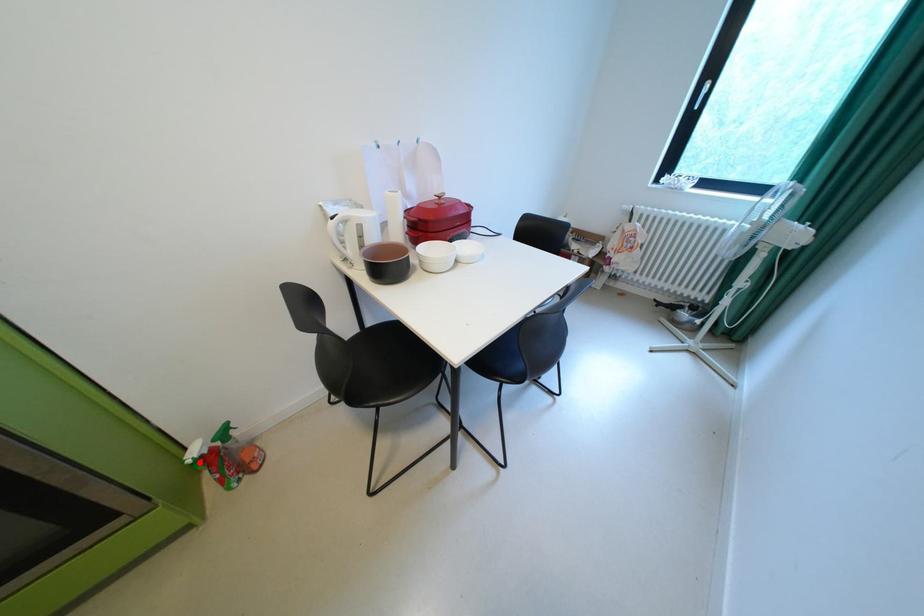
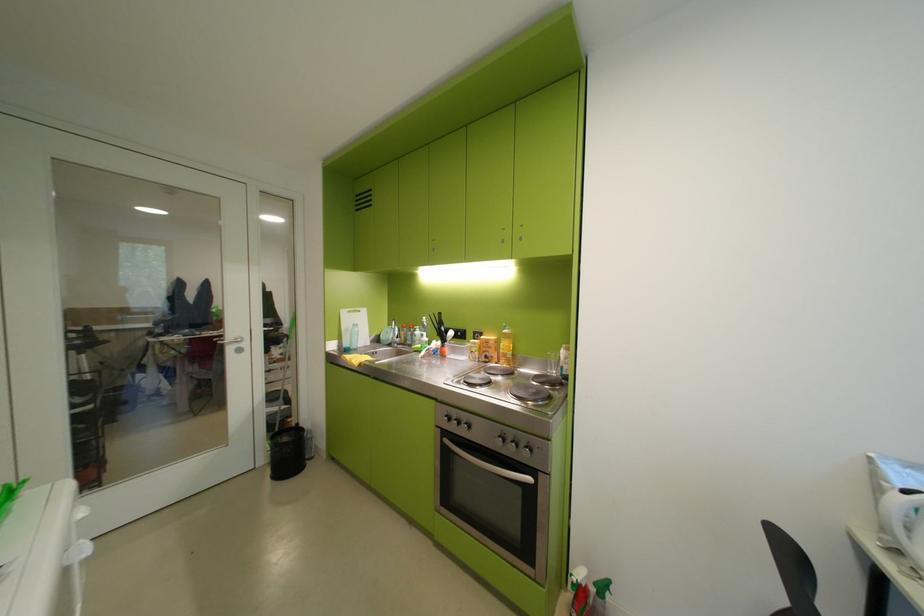
Where in the second image is the point corresponding to the highlighted location from the first image?

(585, 581)